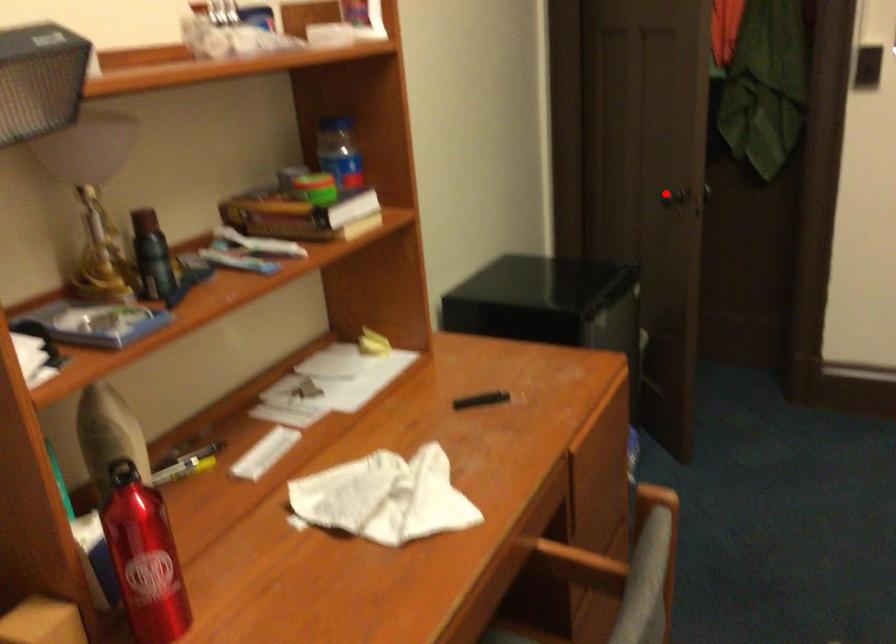
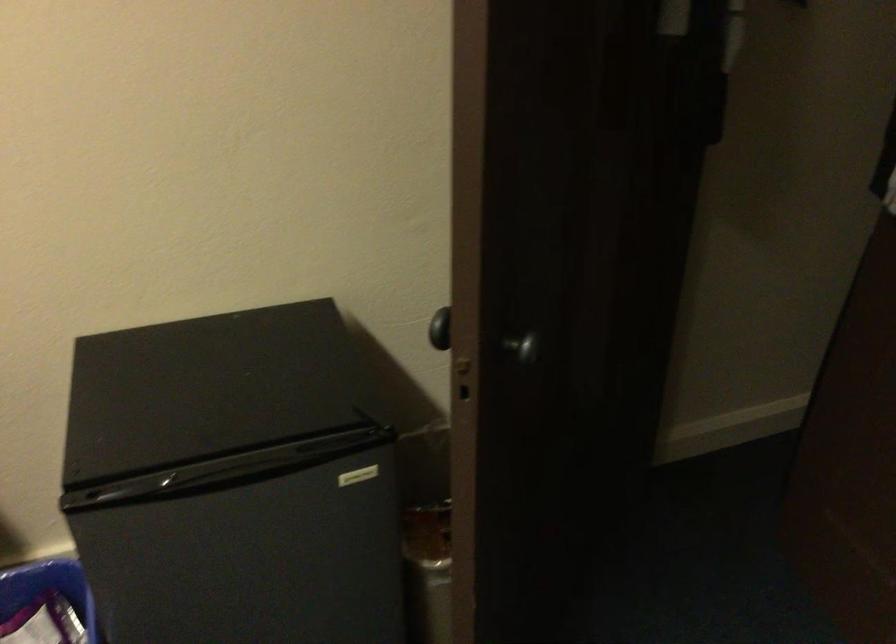
Question: I am providing you with two images of the same scene from different viewpoints. A red point is marked on the first image. Is the red point's position out of view in image 2?

Choices:
 (A) Yes
 (B) No

Answer: (A)